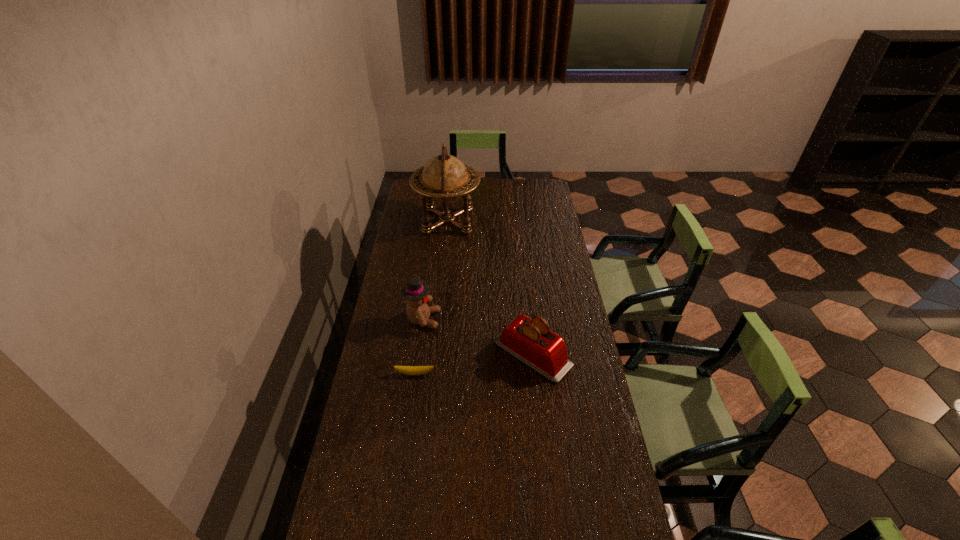
Where is `free spot between the farthest object and the rag_doll`? free spot between the farthest object and the rag_doll is located at coordinates (435, 271).

You are a GUI agent. You are given a task and a screenshot of the screen. Output one action in this format:
    pyautogui.click(x=<x>, y=<y>)
    Task: Click on the free space between the banana and the third tallest object
    The image size is (960, 540).
    Given the screenshot: What is the action you would take?
    pyautogui.click(x=473, y=363)

Locate an element on the screen. free spot between the toaster and the globe is located at coordinates (490, 287).

Image resolution: width=960 pixels, height=540 pixels. I want to click on vacant space that's between the shortest object and the rag_doll, so click(x=419, y=347).

The height and width of the screenshot is (540, 960). Find the location of `free spot between the globe and the rag_doll`. free spot between the globe and the rag_doll is located at coordinates (435, 271).

Select which object appears as the closest to the globe. Please provide its 2D coordinates. Your answer should be formatted as a tuple, i.e. [(x, y)], where the tuple contains the x and y coordinates of a point satisfying the conditions above.

[(415, 291)]

Where is `object that is the third closest to the third shortest object`? object that is the third closest to the third shortest object is located at coordinates (445, 178).

Where is `free space that satisfies the following two spatial constraints: 1. on the front-facing side of the rag_doll; 2. on the right side of the toaster`? This screenshot has width=960, height=540. free space that satisfies the following two spatial constraints: 1. on the front-facing side of the rag_doll; 2. on the right side of the toaster is located at coordinates (419, 354).

The image size is (960, 540). Identify the location of free spot that satisfies the following two spatial constraints: 1. on the front-facing side of the second tallest object; 2. on the left side of the third tallest object. (419, 354).

Where is `free location that satisfies the following two spatial constraints: 1. on the front-facing side of the tallest object; 2. on the left side of the toaster`? This screenshot has height=540, width=960. free location that satisfies the following two spatial constraints: 1. on the front-facing side of the tallest object; 2. on the left side of the toaster is located at coordinates (435, 354).